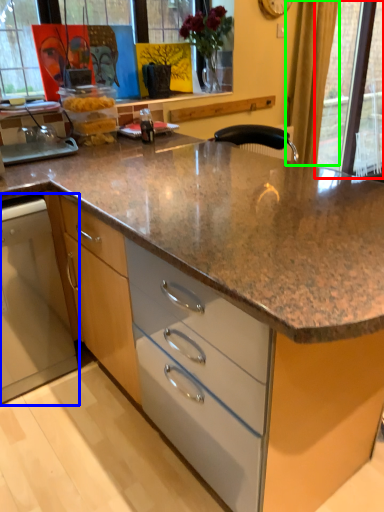
Question: Estimate the real-world distances between objects in this image. Which object is closer to glass door (highlighted by a red box), home appliance (highlighted by a blue box) or curtain (highlighted by a green box)?

Choices:
 (A) home appliance
 (B) curtain

Answer: (B)